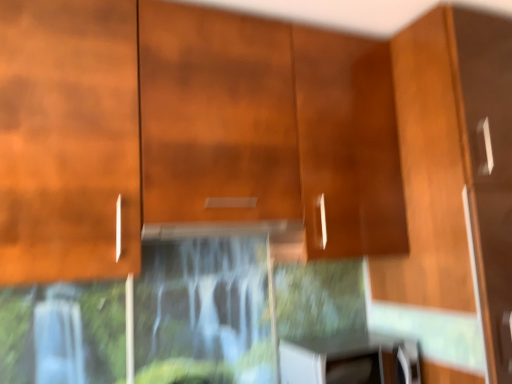
I want to click on white glossy toaster at lower right, so click(x=349, y=360).

What is the approximate width of white glossy toaster at lower right?

It is 14.90 inches.

Describe the element at coordinates (349, 360) in the screenshot. I see `white glossy toaster at lower right` at that location.

Where is `white glossy toaster at lower right`? white glossy toaster at lower right is located at coordinates (349, 360).